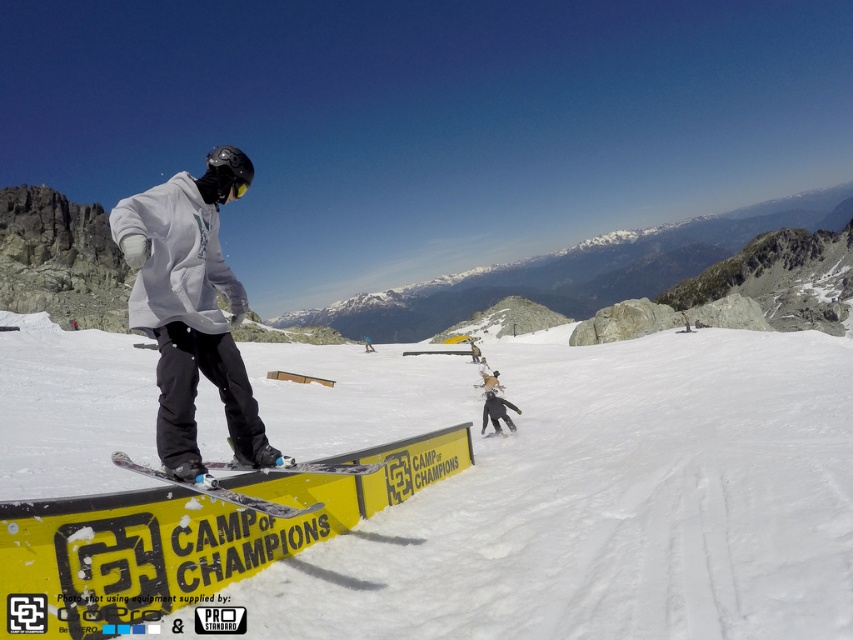
Question: Which point is closer to the camera taking this photo?

Choices:
 (A) (273, 516)
 (B) (498, 406)
 (C) (235, 420)

Answer: (A)

Question: Considering the real-world distances, which object is closest to the white matte snow at center?

Choices:
 (A) white matte snowboarder at center
 (B) matte gray snowboard at center
 (C) metallic silver snowboard at center

Answer: (A)

Question: Is matte gray snowboard at center further to the viewer compared to white matte snowboarder at center?

Choices:
 (A) no
 (B) yes

Answer: (A)

Question: Is white matte snow at center positioned before matte gray snowboard at center?

Choices:
 (A) no
 (B) yes

Answer: (A)

Question: Which object is farther from the camera taking this photo?

Choices:
 (A) matte gray snowboard at center
 (B) metallic silver snowboard at center
 (C) white matte snowboarder at center
 (D) white matte snow at center

Answer: (C)

Question: Does metallic silver snowboard at center have a greater width compared to white matte snowboarder at center?

Choices:
 (A) yes
 (B) no

Answer: (A)